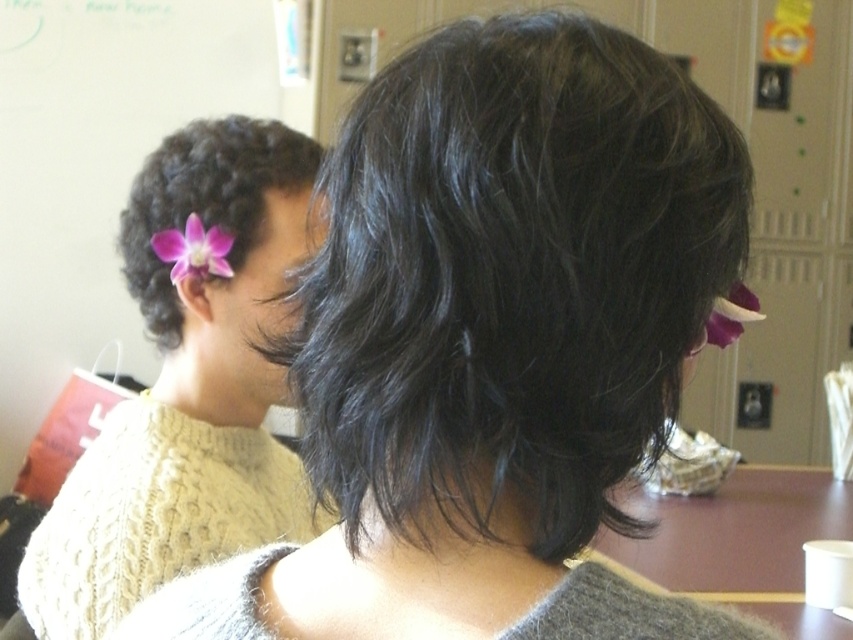
You are an art student observing two flowers in the image. You notice both a pink flower at left and a purple matte flower at left. Which flower is positioned closer to you?

The pink flower at left is closer to the viewer than the purple matte flower at left.

What is the object located at the coordinate point (204, 198) in the image?

The point (204, 198) is located on the purple matte flower at left.

You are standing in front of the image and want to locate the purple matte flower at left. According to the coordinates provided, where should you look?

The purple matte flower at left is located at coordinates point (204, 198).